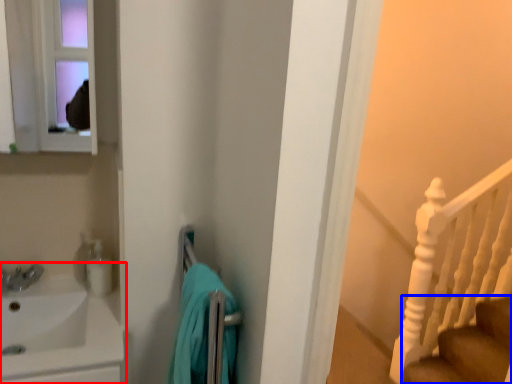
Question: Which object is closer to the camera taking this photo, sink (highlighted by a red box) or stairs (highlighted by a blue box)?

Choices:
 (A) sink
 (B) stairs

Answer: (A)